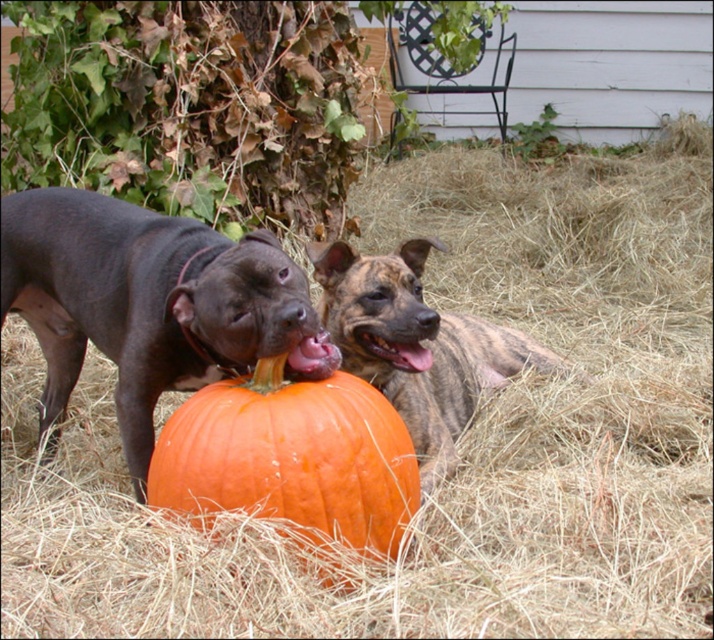
Question: Is black smooth dog at center further to camera compared to brindle fur dog at center?

Choices:
 (A) no
 (B) yes

Answer: (A)

Question: Which of these objects is positioned farthest from the orange matte pumpkin at center?

Choices:
 (A) black smooth dog at center
 (B) brindle fur dog at center

Answer: (B)

Question: Which point appears farthest from the camera in this image?

Choices:
 (A) (452, 394)
 (B) (316, 531)
 (C) (114, 310)

Answer: (A)

Question: Among these objects, which one is nearest to the camera?

Choices:
 (A) orange matte pumpkin at center
 (B) black smooth dog at center
 (C) brindle fur dog at center

Answer: (B)

Question: Does black smooth dog at center lie in front of orange matte pumpkin at center?

Choices:
 (A) no
 (B) yes

Answer: (B)

Question: Can you confirm if black smooth dog at center is smaller than brindle fur dog at center?

Choices:
 (A) no
 (B) yes

Answer: (A)